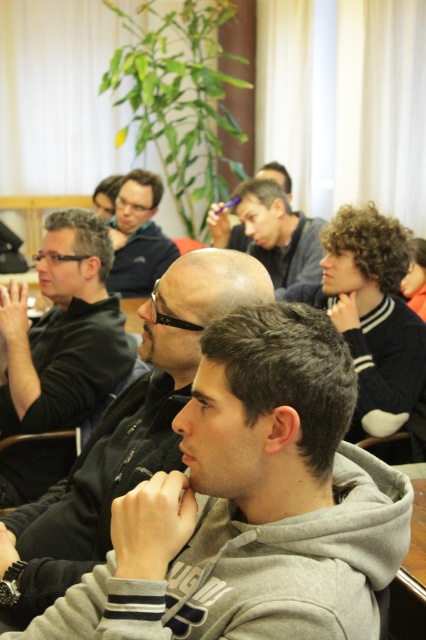
Question: Is gray hoodie at center closer to camera compared to matte black hair at center?

Choices:
 (A) yes
 (B) no

Answer: (A)

Question: Which object is positioned farthest from the dark blue sweater at center?

Choices:
 (A) gray hoodie at center
 (B) matte black hair at center
 (C) matte gray hoodie at center
 (D) matte black jacket at upper center

Answer: (B)

Question: Estimate the real-world distances between objects in this image. Which object is farther from the matte black jacket at left?

Choices:
 (A) matte black hair at center
 (B) matte gray hoodie at center
 (C) gray hoodie at center
 (D) matte black jacket at upper center

Answer: (A)

Question: Among these objects, which one is nearest to the camera?

Choices:
 (A) matte black hair at center
 (B) gray hoodie at center

Answer: (B)

Question: Does gray hoodie at center appear under matte gray hoodie at center?

Choices:
 (A) no
 (B) yes

Answer: (B)

Question: Is matte black jacket at left smaller than matte gray hoodie at center?

Choices:
 (A) yes
 (B) no

Answer: (A)